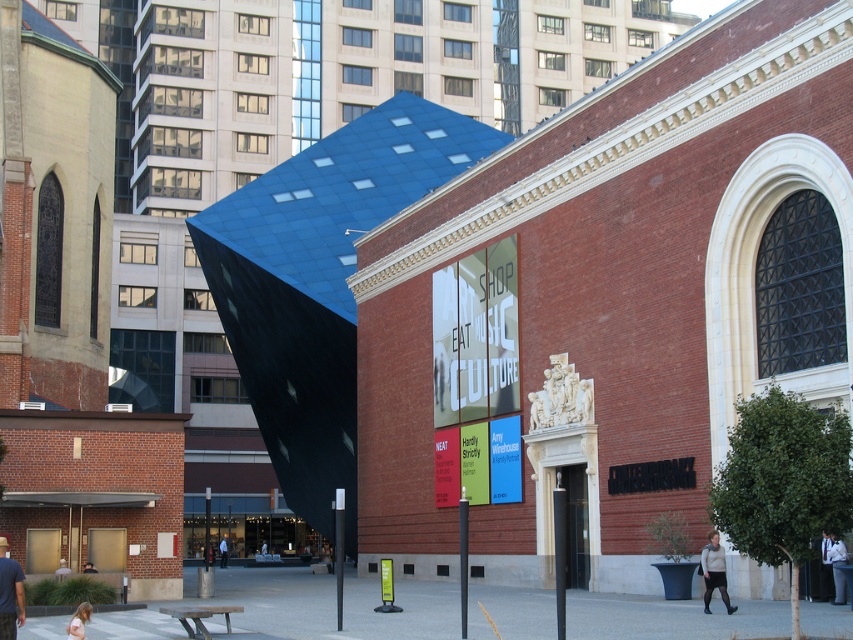
You are a photographer taking a picture of the urban scene. You notice two people in the frame, one wearing a light gray sweater at lower right and another with blonde hair at lower left. Which person is closer to the camera based on their clothing size?

The light gray sweater at lower right is narrower than the blonde hair at lower left, so the person in the light gray sweater at lower right is closer to the camera.